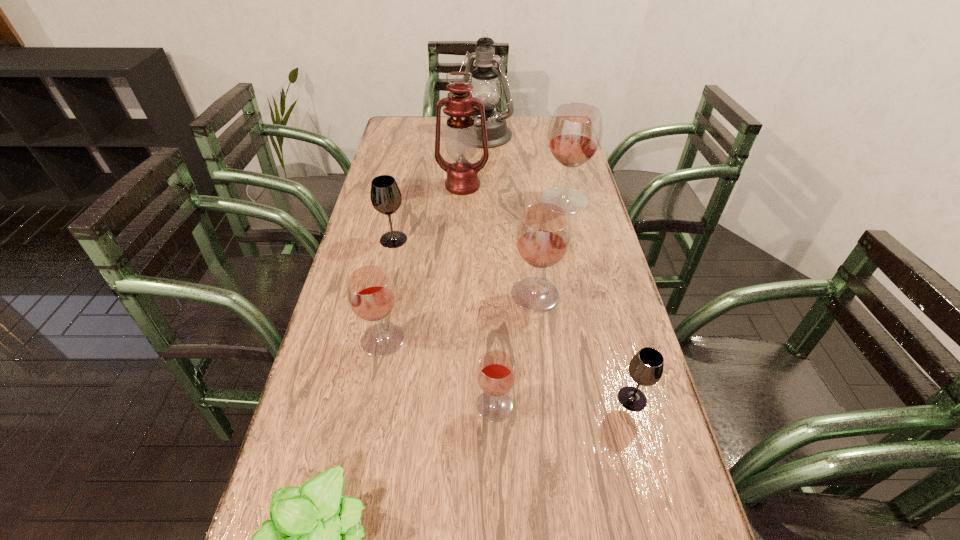
Image resolution: width=960 pixels, height=540 pixels. Find the location of `the right gray wineglass`. the right gray wineglass is located at coordinates (646, 368).

Find the location of a particular element. This screenshot has height=540, width=960. the smaller gray wineglass is located at coordinates (646, 368).

Locate an element on the screen. Image resolution: width=960 pixels, height=540 pixels. the nearest red wineglass is located at coordinates (496, 374).

The height and width of the screenshot is (540, 960). Identify the location of the fourth wineglass from right to left. (496, 374).

The height and width of the screenshot is (540, 960). What are the coordinates of `free region located on the back of the nearer oil lamp` in the screenshot? It's located at (465, 138).

Where is `free region located on the right of the farther oil lamp`? free region located on the right of the farther oil lamp is located at coordinates (547, 137).

The width and height of the screenshot is (960, 540). I want to click on free space located 0.390m on the back of the farthest wineglass, so click(549, 133).

Identify the location of free point located on the left of the fifth farthest object. The image size is (960, 540). (413, 294).

Find the location of a particular element. This screenshot has height=540, width=960. vacant space positioned on the right of the fourth nearest object is located at coordinates (516, 339).

The image size is (960, 540). I want to click on free space located on the back of the fourth farthest object, so coord(401,202).